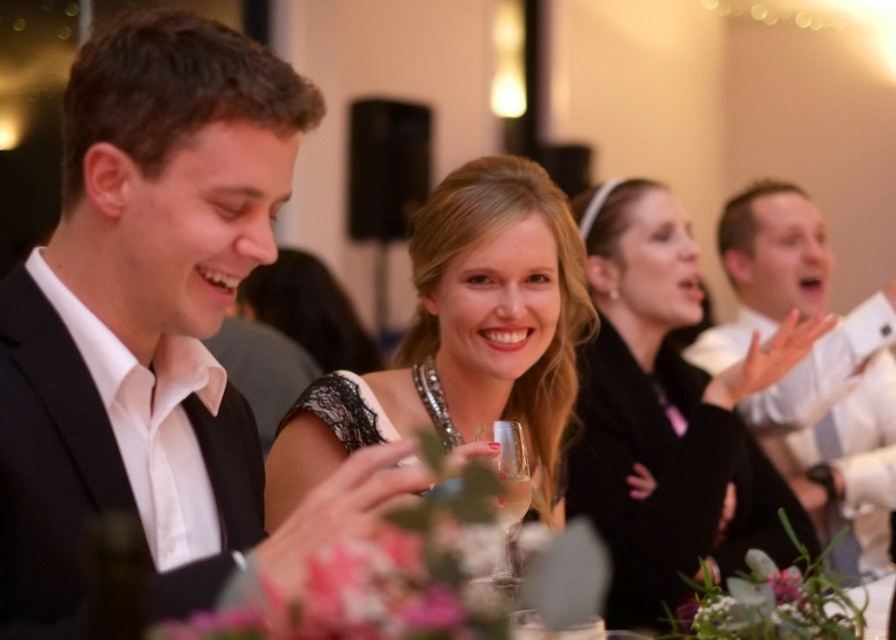
Question: Which of the following is the farthest from the observer?

Choices:
 (A) clear glass wine glass at center
 (B) black satin dress at upper right
 (C) matte black dress at center

Answer: (B)

Question: Can you confirm if black satin dress at upper right is thinner than white satin shirt at right?

Choices:
 (A) no
 (B) yes

Answer: (A)

Question: Which object is positioned closest to the matte black dress at center?

Choices:
 (A) white satin shirt at right
 (B) black satin suit at left
 (C) black satin dress at upper right
 (D) clear glass wine glass at center

Answer: (C)

Question: Which object is closer to the camera taking this photo?

Choices:
 (A) black satin dress at upper right
 (B) matte black dress at center
 (C) black satin suit at left

Answer: (C)

Question: Can you confirm if black satin suit at left is bigger than clear glass wine glass at center?

Choices:
 (A) no
 (B) yes

Answer: (B)

Question: Is black satin dress at upper right wider than clear glass wine glass at center?

Choices:
 (A) no
 (B) yes

Answer: (B)